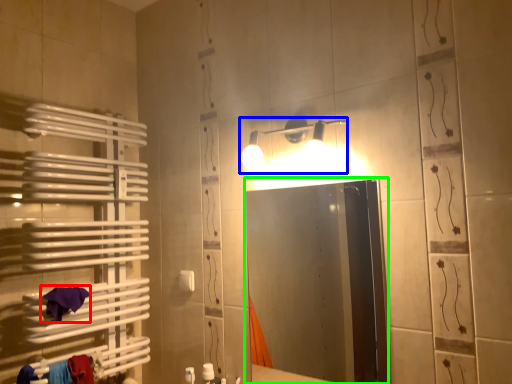
Question: Considering the real-world distances, which object is farthest from bath towel (highlighted by a red box)? light fixture (highlighted by a blue box) or mirror (highlighted by a green box)?

Choices:
 (A) light fixture
 (B) mirror

Answer: (B)